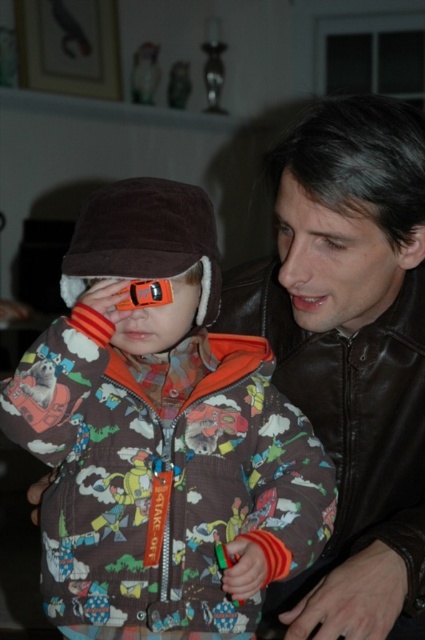
Consider the image. Which is above, leather jacket at right or brown fuzzy hat at upper left?

brown fuzzy hat at upper left

Image resolution: width=425 pixels, height=640 pixels. Describe the element at coordinates (350, 417) in the screenshot. I see `leather jacket at right` at that location.

Between point (286, 326) and point (101, 211), which one is positioned in front?

Point (101, 211)

Where is `leather jacket at right`? The width and height of the screenshot is (425, 640). leather jacket at right is located at coordinates (350, 417).

Does brown fleece jacket at center have a smaller size compared to brown fuzzy hat at upper left?

Incorrect, brown fleece jacket at center is not smaller in size than brown fuzzy hat at upper left.

Which is behind, point (163, 394) or point (102, 200)?

Point (163, 394)

Where is `brown fleece jacket at center`? brown fleece jacket at center is located at coordinates (161, 436).

Which is more to the left, brown fleece jacket at center or leather jacket at right?

brown fleece jacket at center

Is point (246, 436) closer to camera compared to point (382, 528)?

Yes.

Who is more forward, (260, 470) or (306, 406)?

Point (260, 470)

At what (x,y) coordinates should I click in order to perform the action: click on brown fleece jacket at center. Please return your answer as a coordinate pair (x, y). The image size is (425, 640). Looking at the image, I should click on (161, 436).